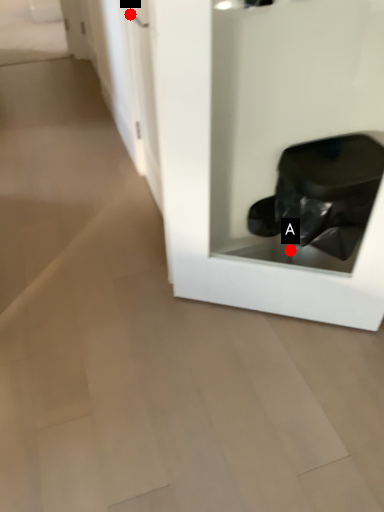
Question: Two points are circled on the image, labeled by A and B beside each circle. Among these points, which one is nearest to the camera?

Choices:
 (A) A is closer
 (B) B is closer

Answer: (B)